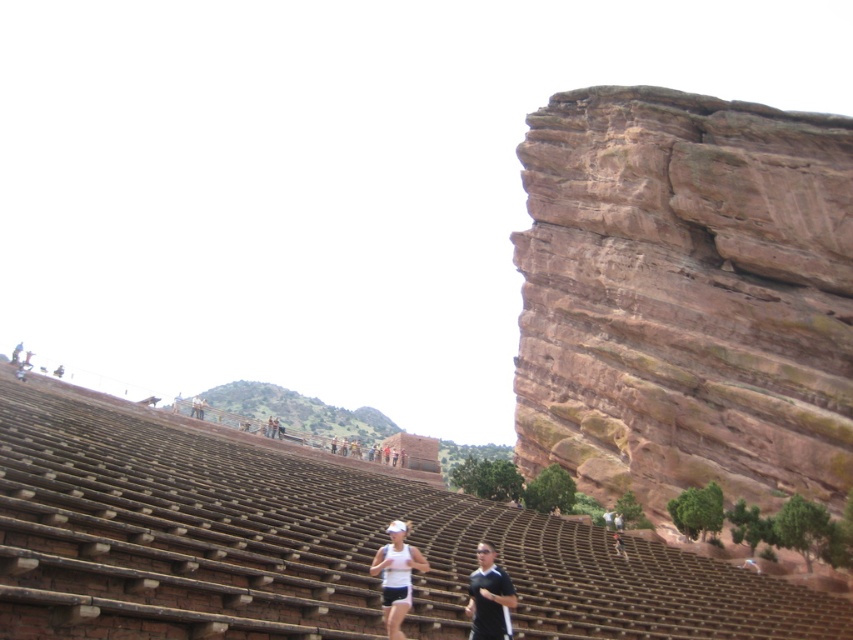
Question: Among these points, which one is nearest to the camera?

Choices:
 (A) (809, 403)
 (B) (395, 548)

Answer: (B)

Question: Is rustic stone cliff at right bigger than white matte tank top at center?

Choices:
 (A) yes
 (B) no

Answer: (A)

Question: Is white matte tank top at center to the left of black fabric shirt at center from the viewer's perspective?

Choices:
 (A) yes
 (B) no

Answer: (A)

Question: Is rustic stone cliff at right below white matte tank top at center?

Choices:
 (A) no
 (B) yes

Answer: (A)

Question: Which of the following is the farthest from the observer?

Choices:
 (A) black fabric shirt at center
 (B) white matte tank top at center
 (C) rustic stone cliff at right

Answer: (C)

Question: Which object is farther from the camera taking this photo?

Choices:
 (A) rustic stone cliff at right
 (B) black fabric shirt at center

Answer: (A)